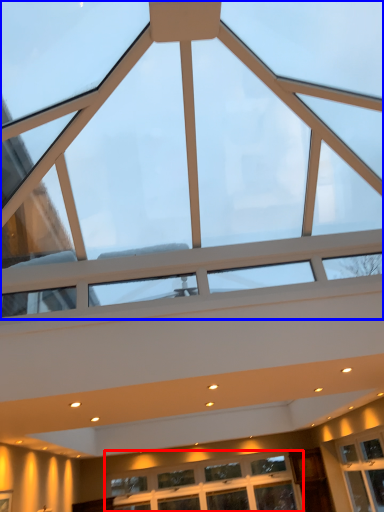
Question: Which of the following is the farthest to the observer, window (highlighted by a red box) or window (highlighted by a blue box)?

Choices:
 (A) window
 (B) window

Answer: (A)